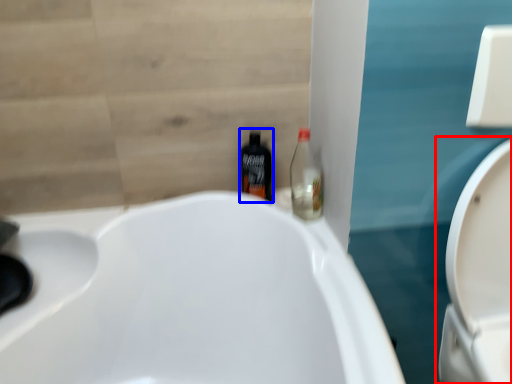
Question: Which object appears farthest to the camera in this image, toilet (highlighted by a red box) or bottle (highlighted by a blue box)?

Choices:
 (A) toilet
 (B) bottle

Answer: (B)